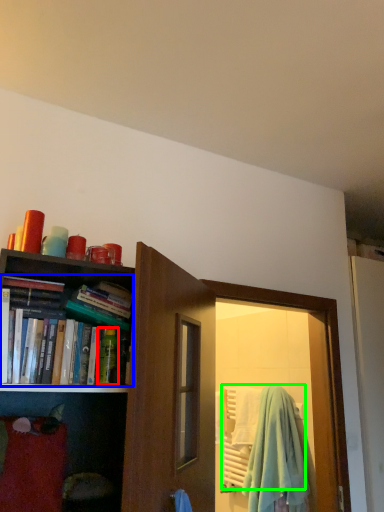
Question: Which object is the farthest from toiletry (highlighted by a red box)? Choose among these: book (highlighted by a blue box) or beach towel (highlighted by a green box).

Choices:
 (A) book
 (B) beach towel

Answer: (B)